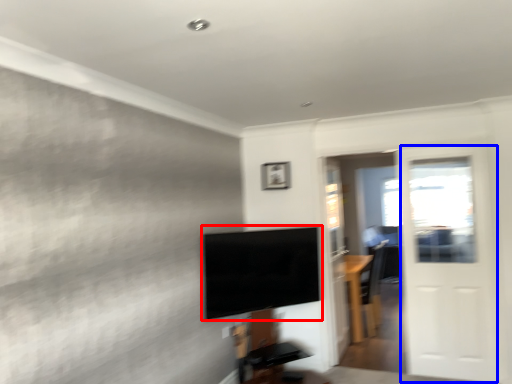
Question: Which point is further to the camera, television (highlighted by a red box) or screen door (highlighted by a blue box)?

Choices:
 (A) television
 (B) screen door

Answer: (B)